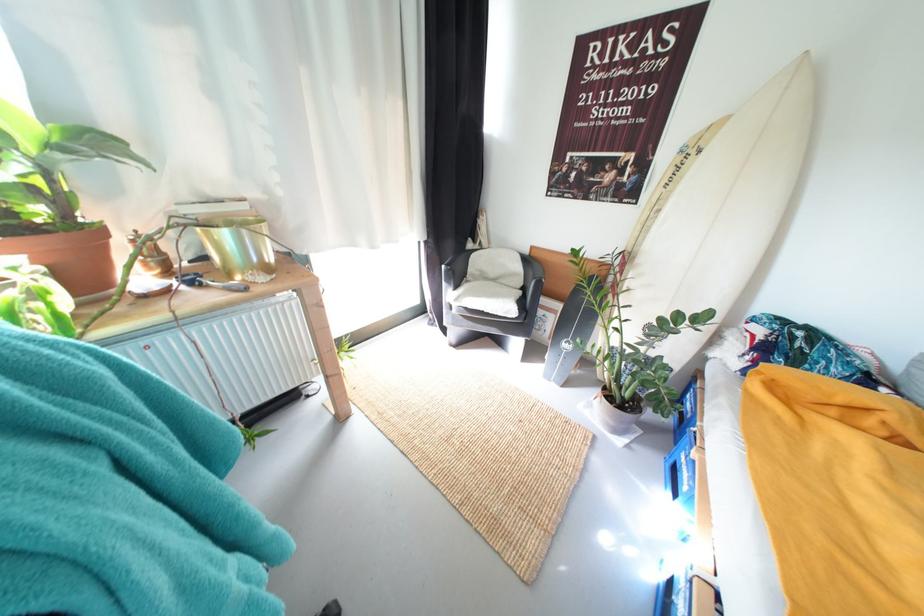
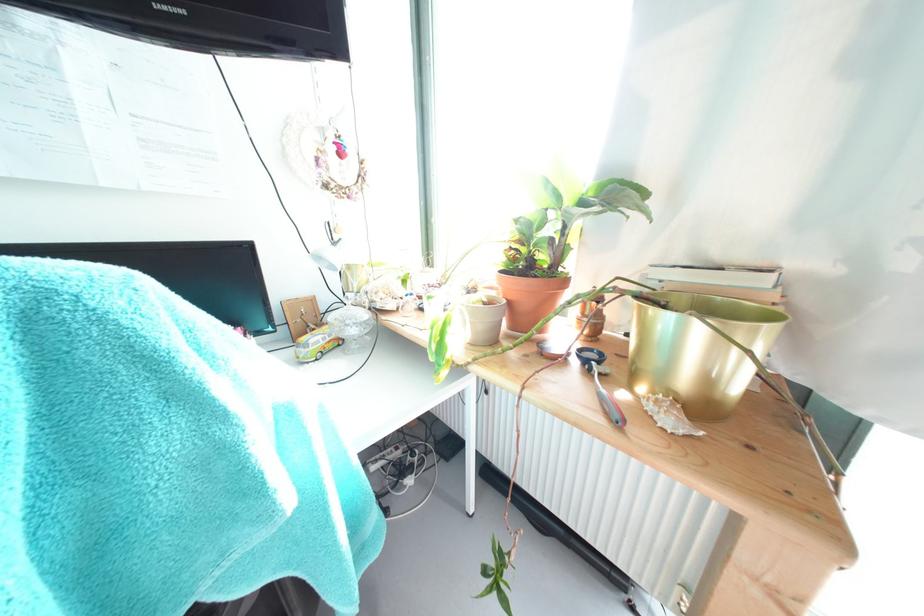
Locate, in the second image, the point that corresponds to (x=252, y=208) in the first image.

(771, 283)